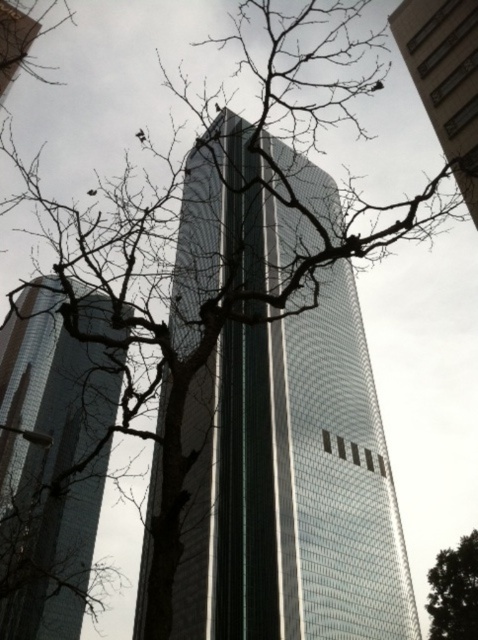
Is shiny glass tower at left positioned at the back of glassy reflective skyscraper at upper center?

No, shiny glass tower at left is in front of glassy reflective skyscraper at upper center.

Which of these two, shiny glass tower at left or glassy reflective skyscraper at upper center, stands taller?

Standing taller between the two is shiny glass tower at left.

The height and width of the screenshot is (640, 478). What do you see at coordinates (50, 467) in the screenshot? I see `shiny glass tower at left` at bounding box center [50, 467].

Image resolution: width=478 pixels, height=640 pixels. I want to click on shiny glass tower at left, so click(x=50, y=467).

Can you confirm if glassy reflective skyscraper at center is smaller than shiny glass tower at left?

Indeed, glassy reflective skyscraper at center has a smaller size compared to shiny glass tower at left.

Does glassy reflective skyscraper at center appear on the left side of shiny glass tower at left?

Incorrect, glassy reflective skyscraper at center is not on the left side of shiny glass tower at left.

This screenshot has width=478, height=640. Identify the location of glassy reflective skyscraper at center. (292, 484).

In the scene shown: Is glassy reflective skyscraper at upper center positioned in front of green leafy tree at center?

Yes, glassy reflective skyscraper at upper center is in front of green leafy tree at center.

Can you confirm if glassy reflective skyscraper at upper center is wider than green leafy tree at center?

No, glassy reflective skyscraper at upper center is not wider than green leafy tree at center.

Find the location of a particular element. The height and width of the screenshot is (640, 478). glassy reflective skyscraper at upper center is located at coordinates (443, 67).